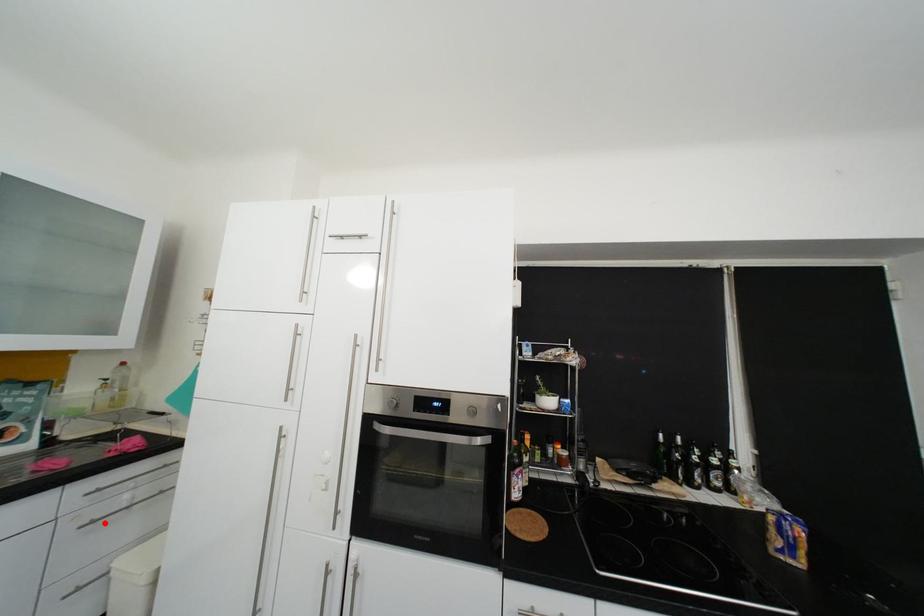
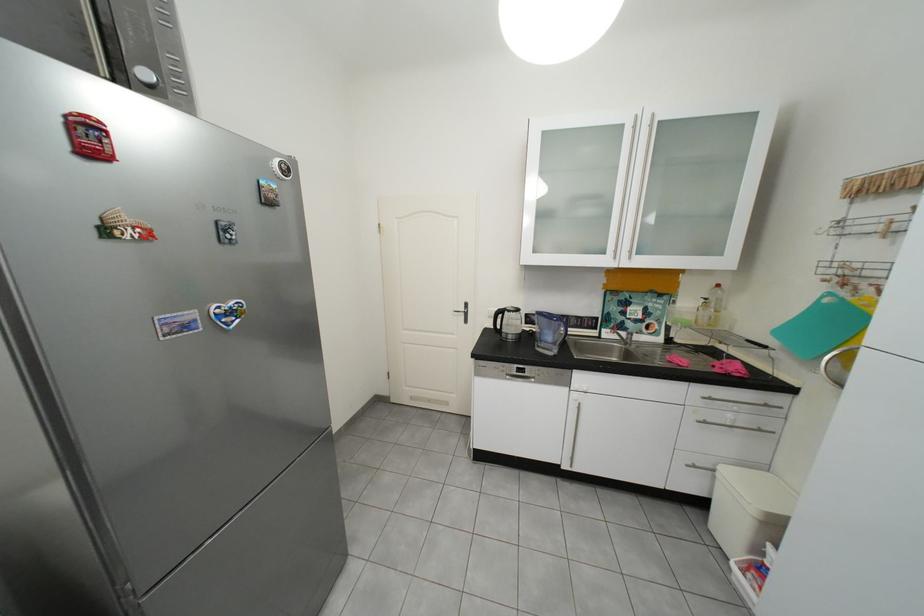
Locate, in the second image, the point that corresponds to the highlighted location in the first image.

(718, 424)